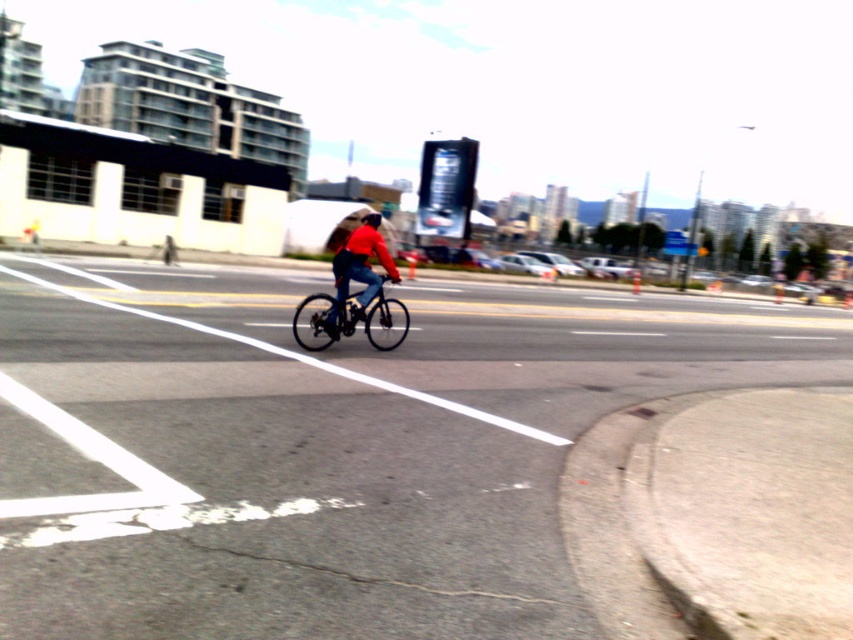
Question: Which point is farther to the camera?

Choices:
 (A) shiny black bicycle at center
 (B) black matte bicycle helmet at center
 (C) black rubber bike lane at center
 (D) matte red jacket at center

Answer: (A)

Question: Can you confirm if shiny black bicycle at center is positioned above black matte bicycle helmet at center?

Choices:
 (A) yes
 (B) no

Answer: (B)

Question: Does matte red jacket at center have a larger size compared to black matte bicycle helmet at center?

Choices:
 (A) no
 (B) yes

Answer: (A)

Question: Does black rubber bike lane at center have a larger size compared to shiny black bicycle at center?

Choices:
 (A) no
 (B) yes

Answer: (B)

Question: Which point is farther to the camera?

Choices:
 (A) black matte bicycle helmet at center
 (B) black rubber bike lane at center
 (C) shiny black bicycle at center

Answer: (C)

Question: Which object appears farthest from the camera in this image?

Choices:
 (A) shiny black bicycle at center
 (B) black rubber bike lane at center

Answer: (A)